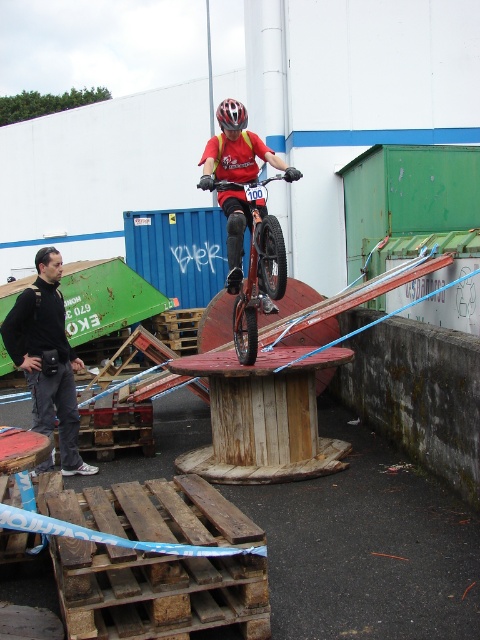
Is point (22, 294) farther from camera compared to point (279, 268)?

Yes, point (22, 294) is farther from viewer.

Is black fabric camera at left to the left of orange matte mountain bike at center from the viewer's perspective?

Indeed, black fabric camera at left is positioned on the left side of orange matte mountain bike at center.

Is point (47, 260) farther from camera compared to point (240, 188)?

Yes, it is.

You are a GUI agent. You are given a task and a screenshot of the screen. Output one action in this format:
    pyautogui.click(x=<x>, y=<y>)
    Task: Click on the black fabric camera at left
    The width and height of the screenshot is (480, 640).
    Given the screenshot: What is the action you would take?
    pyautogui.click(x=48, y=356)

Is orange matte mountain bike at center positioned in front of black matte bicycle helmet at upper center?

Yes, orange matte mountain bike at center is in front of black matte bicycle helmet at upper center.

Which is more to the right, orange matte mountain bike at center or black matte bicycle helmet at upper center?

orange matte mountain bike at center is more to the right.

Is point (251, 305) positioned after point (240, 102)?

That is False.

Locate an element on the screen. The width and height of the screenshot is (480, 640). orange matte mountain bike at center is located at coordinates (257, 269).

Is black fabric camera at left smaller than black matte bicycle helmet at upper center?

No.

Which is more to the left, black fabric camera at left or black matte bicycle helmet at upper center?

From the viewer's perspective, black fabric camera at left appears more on the left side.

Is point (54, 417) less distant than point (220, 125)?

No, (54, 417) is further to viewer.

Locate an element on the screen. The image size is (480, 640). black fabric camera at left is located at coordinates (48, 356).